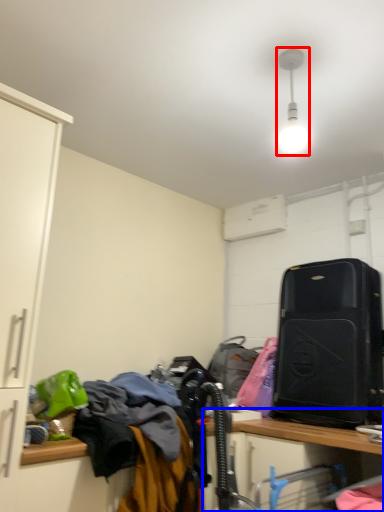
Question: Which object appears closest to the camera in this image, light fixture (highlighted by a red box) or computer desk (highlighted by a blue box)?

Choices:
 (A) light fixture
 (B) computer desk

Answer: (B)